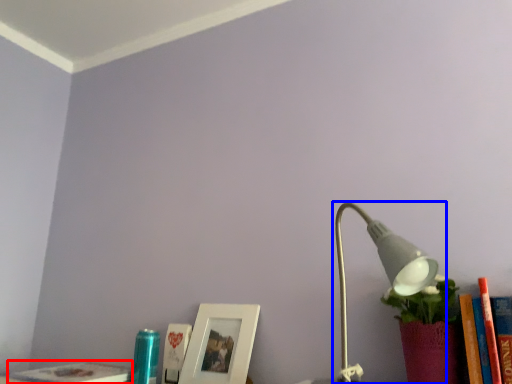
Question: Which object appears farthest to the camera in this image, book (highlighted by a red box) or lamp (highlighted by a blue box)?

Choices:
 (A) book
 (B) lamp

Answer: (A)